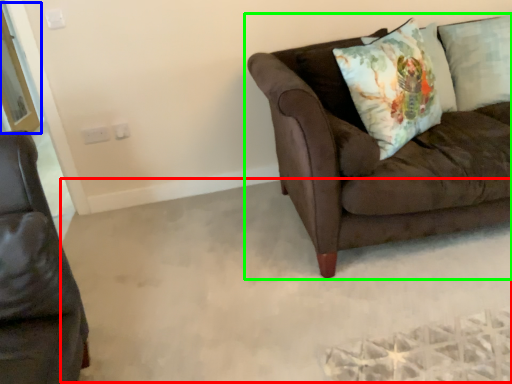
Question: Which object is positioned farthest from plain (highlighted by a red box)? Select from screen door (highlighted by a blue box) and studio couch (highlighted by a green box).

Choices:
 (A) screen door
 (B) studio couch

Answer: (A)